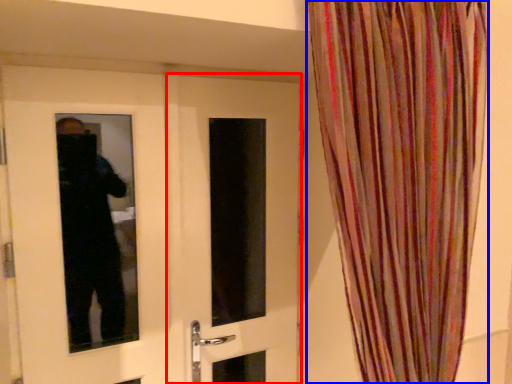
Question: Which of the following is the closest to the observer, door (highlighted by a red box) or curtain (highlighted by a blue box)?

Choices:
 (A) door
 (B) curtain

Answer: (B)